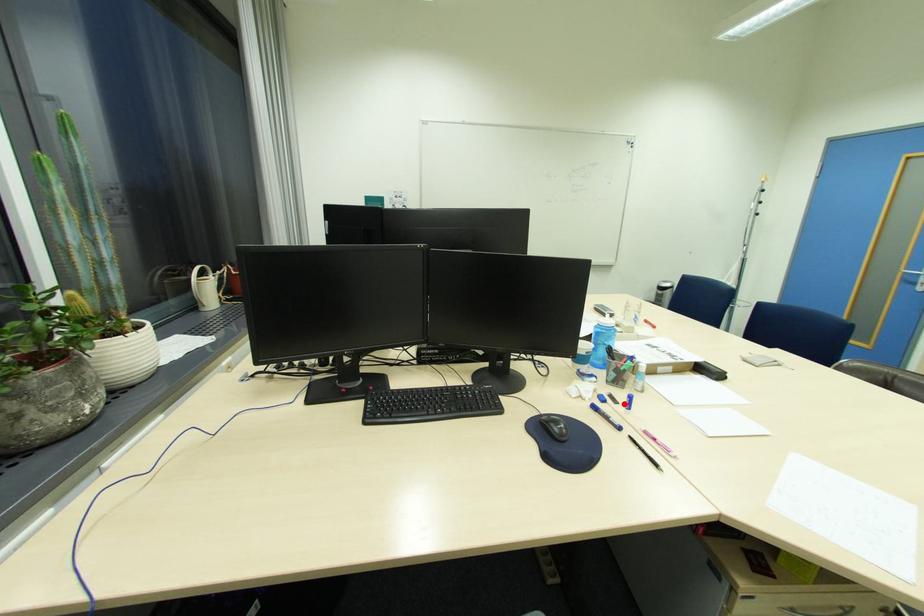
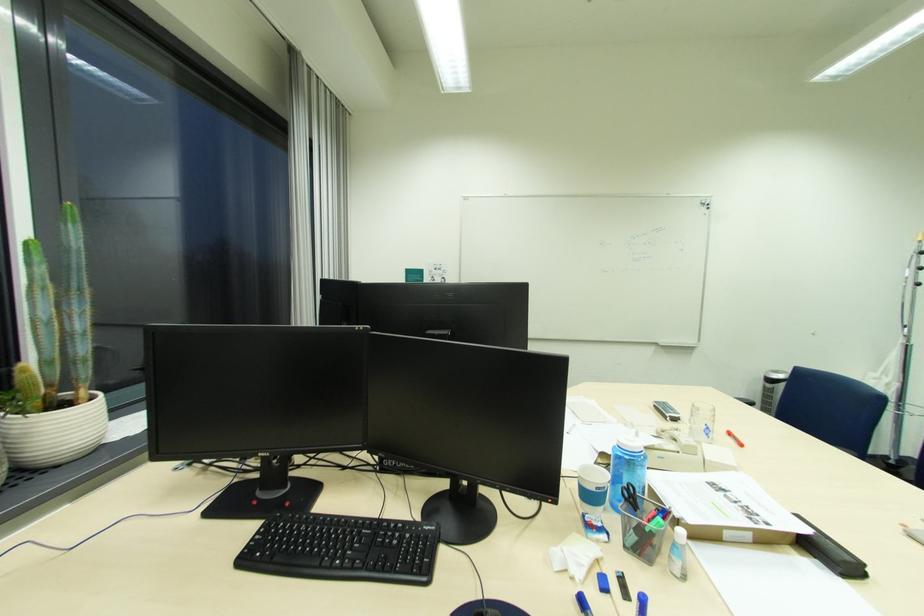
Find the pixel in the second image that matches the highlighted location in the first image.

(636, 601)